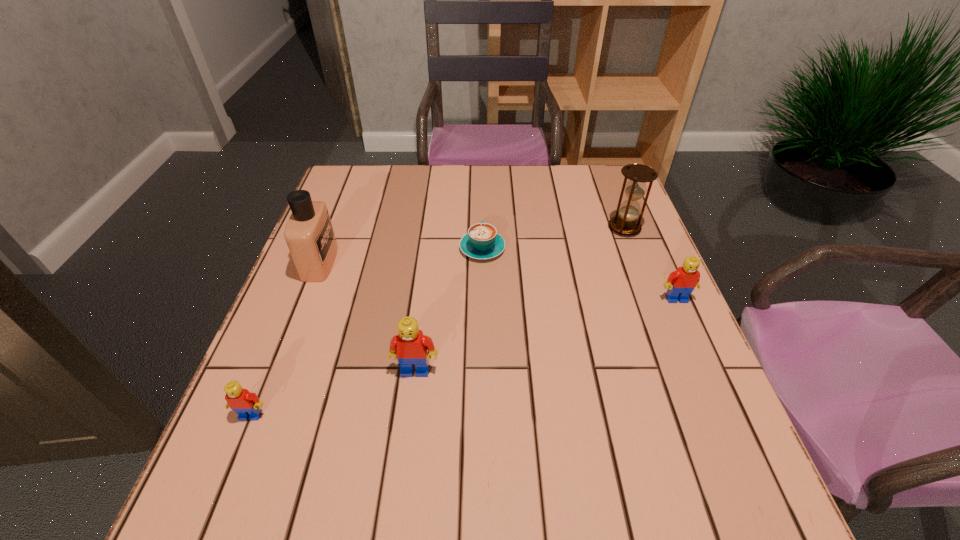
What are the coordinates of `hourglass that is positioned at the right edge` in the screenshot? It's located at (626, 223).

Locate an element on the screen. object situated at the near left corner is located at coordinates (246, 404).

You are a GUI agent. You are given a task and a screenshot of the screen. Output one action in this format:
    pyautogui.click(x=<x>, y=<y>)
    Task: Click on the free spot at the far edge of the desktop
    
    Given the screenshot: What is the action you would take?
    pyautogui.click(x=533, y=165)

Locate an element on the screen. Image resolution: width=960 pixels, height=540 pixels. vacant space at the near edge of the desktop is located at coordinates (519, 448).

Identify the location of vacant position at the right edge of the desktop. (704, 385).

Where is `blank space at the far left corner of the desktop`? This screenshot has width=960, height=540. blank space at the far left corner of the desktop is located at coordinates (348, 178).

You are a GUI agent. You are given a task and a screenshot of the screen. Output one action in this format:
    pyautogui.click(x=<x>, y=<y>)
    Task: Click on the vacant space at the far right corner of the desktop
    This screenshot has width=960, height=540.
    Given the screenshot: What is the action you would take?
    pyautogui.click(x=588, y=177)

Locate an element on the screen. unoccupied position between the second shortest object and the second farthest Lego is located at coordinates (333, 393).

Find the location of `empty location between the hourglass and the second Lego from right to left`. empty location between the hourglass and the second Lego from right to left is located at coordinates (519, 299).

The height and width of the screenshot is (540, 960). Identify the location of empty location between the fourth shortest object and the farthest Lego. (546, 334).